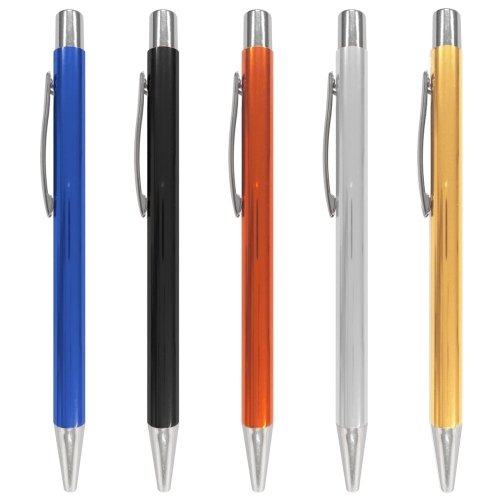
Find the location of `pens`. pens is located at coordinates click(x=64, y=432), click(x=161, y=434), click(x=248, y=419), click(x=361, y=415), click(x=455, y=432).